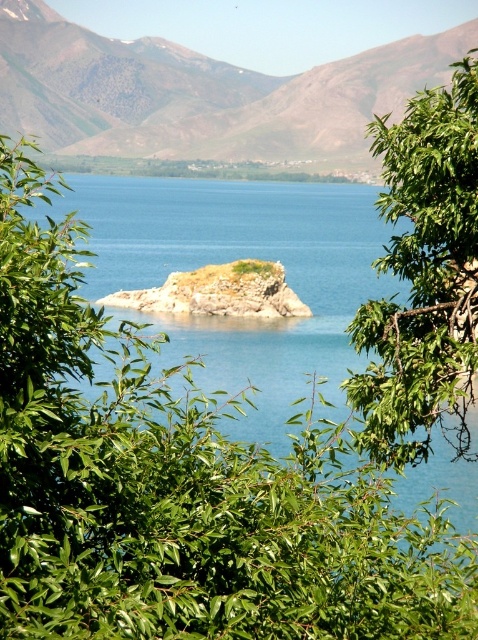
Does green leafy branch at upper right have a smaller size compared to brown rocky island at center?

Indeed, green leafy branch at upper right has a smaller size compared to brown rocky island at center.

Is point (404, 116) positioned before point (240, 316)?

No, (404, 116) is behind (240, 316).

I want to click on green leafy branch at upper right, so (x=423, y=276).

Who is taller, brown rocky mountain at center or green leafy branch at upper right?

With more height is brown rocky mountain at center.

Does brown rocky mountain at center lie behind green leafy branch at upper right?

That is True.

Where is `brown rocky mountain at center`? This screenshot has height=640, width=478. brown rocky mountain at center is located at coordinates (201, 93).

Between point (260, 104) and point (184, 307), which one is positioned in front?

Point (184, 307) is in front.

Is point (60, 74) closer to viewer compared to point (184, 310)?

No, it is behind (184, 310).

This screenshot has height=640, width=478. What are the coordinates of `brown rocky mountain at center` in the screenshot? It's located at (201, 93).